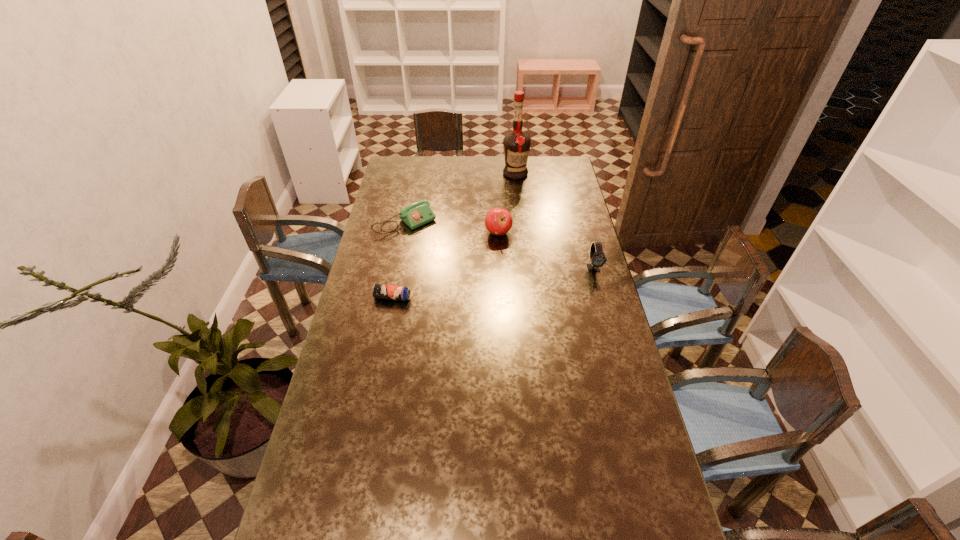
Identify the location of vacant region located 0.340m on the stem of the apple. The height and width of the screenshot is (540, 960). (462, 296).

Locate an element on the screen. Image resolution: width=960 pixels, height=540 pixels. vacant area situated on the stem of the apple is located at coordinates click(479, 267).

This screenshot has height=540, width=960. Find the location of `free region located 0.050m on the stem of the apple`. free region located 0.050m on the stem of the apple is located at coordinates (490, 248).

Identify the location of free space located 0.090m on the front and back of the farthest object. click(510, 191).

The image size is (960, 540). I want to click on blank space located on the front and back of the farthest object, so point(510,191).

The width and height of the screenshot is (960, 540). Identify the location of vacant region located 0.330m on the front and back of the farthest object. (501, 220).

Find the location of a particular element. This screenshot has height=540, width=960. vacant region located 0.050m on the dial of the second shortest object is located at coordinates (429, 241).

I want to click on free region located 0.190m on the dial of the second shortest object, so click(448, 258).

The image size is (960, 540). Find the location of `vacant space positioned on the dial of the second shortest object`. vacant space positioned on the dial of the second shortest object is located at coordinates (468, 278).

This screenshot has height=540, width=960. I want to click on object that is at the far edge, so click(516, 145).